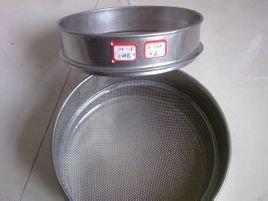
Locate an element on the screen. metal screen is located at coordinates (161, 121).